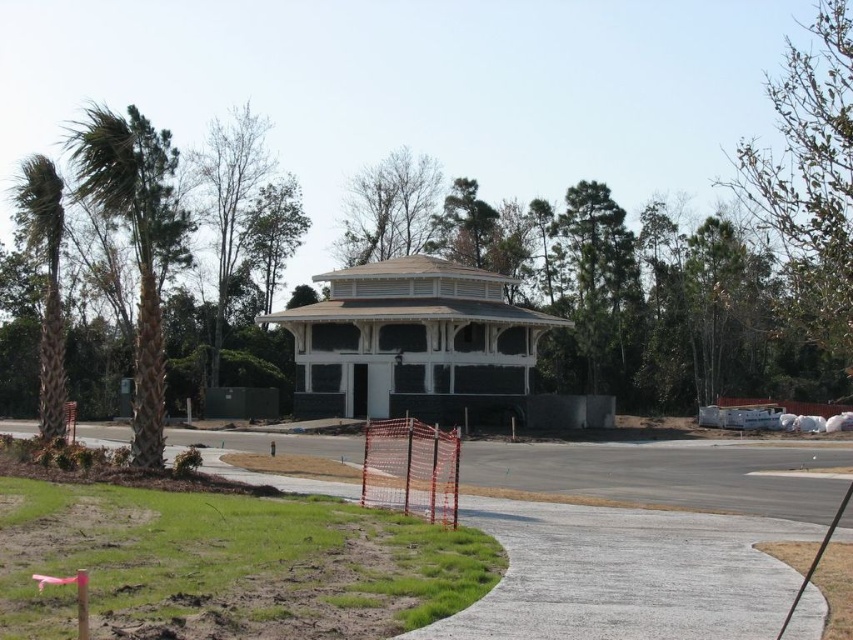
You are a delivery person trying to park your 2.5 meter wide truck near the gray concrete pavement at center and the green textured palm tree at left. Can you park your truck between them without hitting either object?

The gray concrete pavement at center is thinner than the green textured palm tree at left. Since the truck is 2.5 meters wide, it depends on the actual width of the space between them. However, the description only states the pavement is thinner than the palm tree, not the distance between them. Therefore, there is insufficient information to determine if the truck can fit.

You are a construction worker who needs to place a heavy equipment on the gray concrete pavement at center and the white wood gazebo at center. Which location is suitable for placing the equipment?

The gray concrete pavement at center is suitable for placing the heavy equipment because it is made of concrete, which is sturdy and designed to support heavy loads, whereas the white wood gazebo at center is a wooden structure and may not be able to bear the weight safely.

You are standing at the entrance of the partially constructed building and want to walk to the gray concrete pavement at center. Is the point at coordinates (625, 573) on your path?

Yes, the point at coordinates (625, 573) is on the gray concrete pavement at center, so it would be on your path to the pavement.